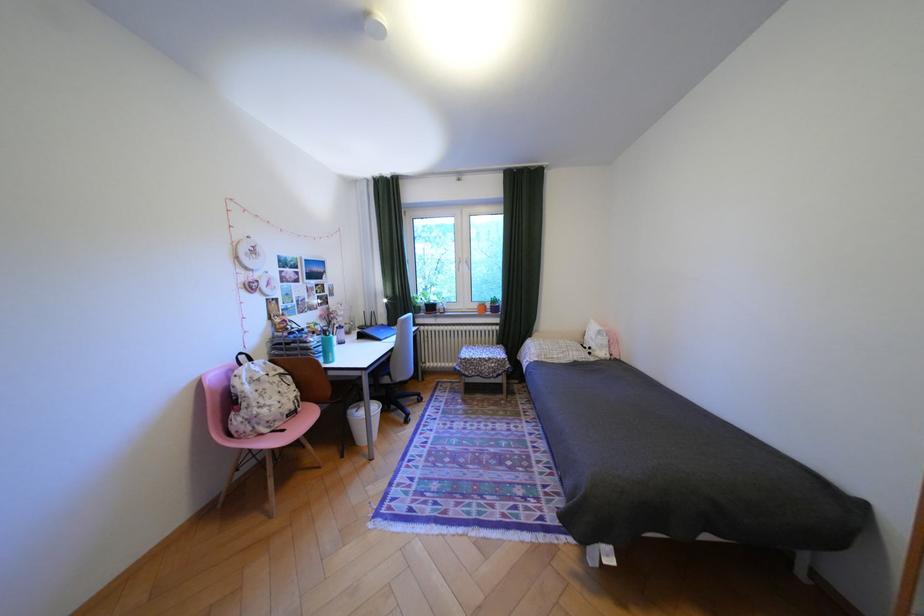
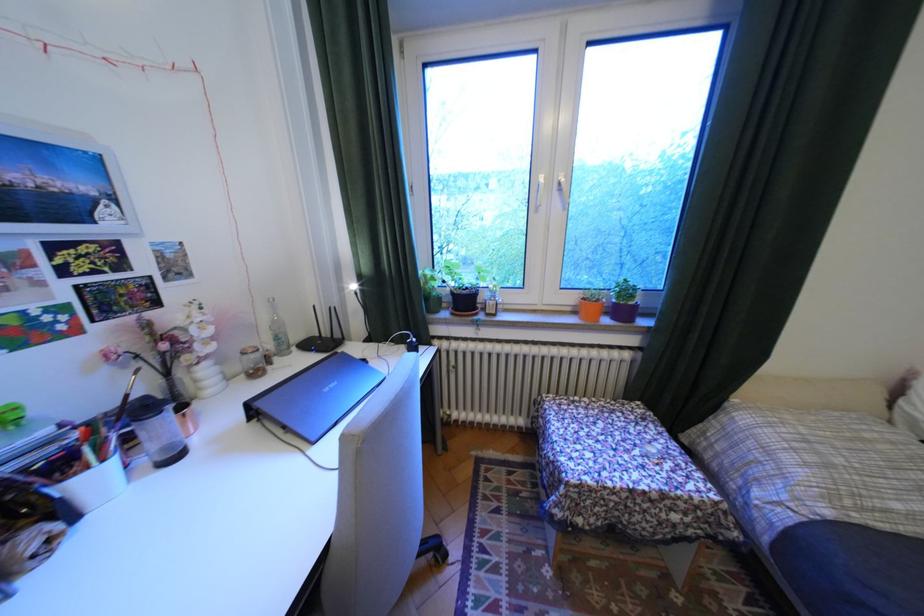
In the second image, find the point that corresponds to [346,339] in the first image.

(106, 479)